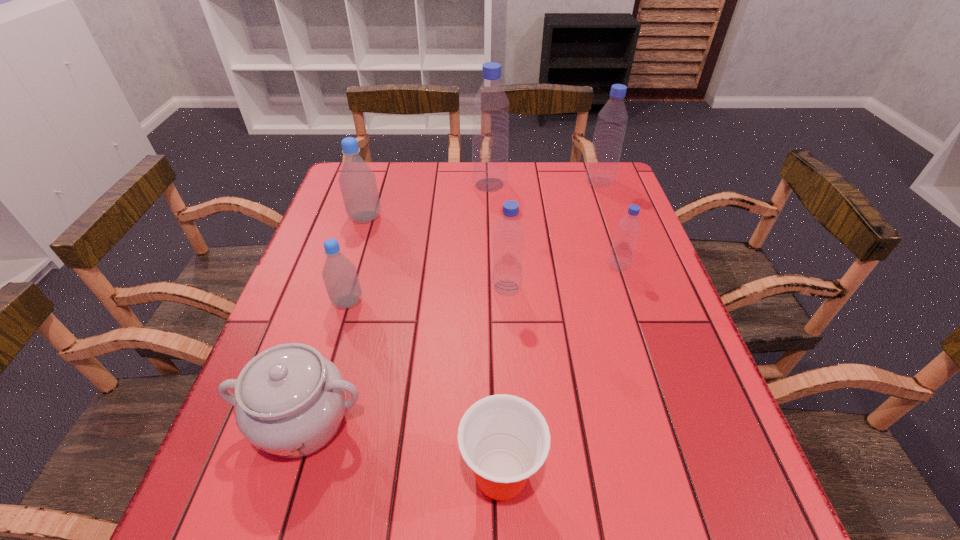
Select which object appears as the fourth closest to the cup. Please provide its 2D coordinates. Your answer should be formatted as a tuple, i.e. [(x, y)], where the tuple contains the x and y coordinates of a point satisfying the conditions above.

[(624, 243)]

Point out which bottle is positioned as the fourth nearest to the sixth nearest object. Please provide its 2D coordinates. Your answer should be formatted as a tuple, i.e. [(x, y)], where the tuple contains the x and y coordinates of a point satisfying the conditions above.

[(624, 243)]

In order to click on bottle that is the second nearest to the smaller gray bottle in this screenshot , I will do `click(509, 234)`.

Identify the location of the closest blue bottle relative to the tallest object. (602, 167).

What are the coordinates of `the closest blue bottle to the red cup` in the screenshot? It's located at (509, 234).

The width and height of the screenshot is (960, 540). Identify the location of vacant area that satisfies the following two spatial constraints: 1. on the back side of the nearest blue bottle; 2. on the left side of the third smallest blue bottle. (500, 183).

Locate an element on the screen. vacant space that satisfies the following two spatial constraints: 1. on the front side of the chinaware; 2. on the right side of the third farthest object is located at coordinates (301, 421).